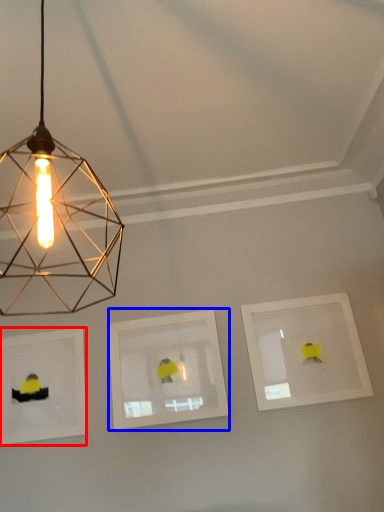
Question: Which object appears farthest to the camera in this image, picture frame (highlighted by a red box) or picture frame (highlighted by a blue box)?

Choices:
 (A) picture frame
 (B) picture frame

Answer: (A)